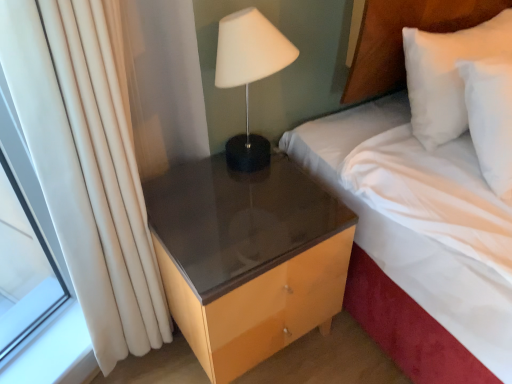
Locate an element on the screen. The image size is (512, 384). glossy wood nightstand at lower right is located at coordinates (247, 258).

What do you see at coordinates (247, 258) in the screenshot? I see `glossy wood nightstand at lower right` at bounding box center [247, 258].

Locate an element on the screen. The width and height of the screenshot is (512, 384). white soft pillow at upper right is located at coordinates (447, 74).

This screenshot has width=512, height=384. In order to click on white fabric bed at upper right in this screenshot , I will do (x=394, y=258).

Locate an element on the screen. The image size is (512, 384). white matte lamp at upper right is located at coordinates (249, 75).

Find the location of `glossy wood nightstand at lower right`. glossy wood nightstand at lower right is located at coordinates (247, 258).

Are white matte lamp at upper right and white fabric bed at upper right making contact?

No, white matte lamp at upper right is not in contact with white fabric bed at upper right.

From a real-world perspective, is white matte lamp at upper right above or below white fabric bed at upper right?

Clearly, from a real-world perspective, white matte lamp at upper right is above white fabric bed at upper right.

Considering the relative sizes of white matte lamp at upper right and white fabric bed at upper right in the image provided, is white matte lamp at upper right smaller than white fabric bed at upper right?

Yes.

Is white soft pillow at upper right not inside glossy wood nightstand at lower right?

Yes, white soft pillow at upper right is located beyond the bounds of glossy wood nightstand at lower right.

You are a GUI agent. You are given a task and a screenshot of the screen. Output one action in this format:
    pyautogui.click(x=<x>, y=<y>)
    Task: Click on the pillow on the right of glossy wood nightstand at lower right
    The height and width of the screenshot is (384, 512).
    Given the screenshot: What is the action you would take?
    pyautogui.click(x=447, y=74)

Relative to glossy wood nightstand at lower right, is white soft pillow at upper right in front or behind?

Visually, white soft pillow at upper right is located behind glossy wood nightstand at lower right.

Based on the photo, can you confirm if white soft pillow at upper right is bigger than white fabric bed at upper right?

Actually, white soft pillow at upper right might be smaller than white fabric bed at upper right.

Between white soft pillow at upper right and white fabric bed at upper right, which one appears on the left side from the viewer's perspective?

Positioned to the left is white soft pillow at upper right.

You are a GUI agent. You are given a task and a screenshot of the screen. Output one action in this format:
    pyautogui.click(x=<x>, y=<y>)
    Task: Click on the pillow behind the white fabric bed at upper right
    
    Given the screenshot: What is the action you would take?
    pyautogui.click(x=447, y=74)

How many degrees apart are the facing directions of white soft pillow at upper right and white fabric bed at upper right?

The facing directions of white soft pillow at upper right and white fabric bed at upper right are 1.35 degrees apart.

Which object is closer to the camera, white soft pillow at upper right or white matte lamp at upper right?

white matte lamp at upper right is more forward.

Is white matte lamp at upper right inside white soft pillow at upper right?

Actually, white matte lamp at upper right is outside white soft pillow at upper right.

From the image's perspective, is white soft pillow at upper right above white matte lamp at upper right?

Yes, from the image's perspective, white soft pillow at upper right is above white matte lamp at upper right.

Is white soft pillow at upper right at the left side of white matte lamp at upper right?

No.

From a real-world perspective, between white matte lamp at upper right and white soft pillow at upper right, who is vertically lower?

white soft pillow at upper right, from a real-world perspective.

Consider the image. Between white matte lamp at upper right and white soft pillow at upper right, which one has more height?

Standing taller between the two is white soft pillow at upper right.

Which of these two, white matte lamp at upper right or white soft pillow at upper right, is wider?

With larger width is white soft pillow at upper right.

Is white matte lamp at upper right outside of white soft pillow at upper right?

Answer: white matte lamp at upper right lies outside white soft pillow at upper right's area.

Does point (231, 292) lie behind point (278, 38)?

That is False.

In the scene shown: Considering the positions of objects glossy wood nightstand at lower right and white matte lamp at upper right in the image provided, who is more to the right, glossy wood nightstand at lower right or white matte lamp at upper right?

white matte lamp at upper right.

This screenshot has height=384, width=512. In order to click on nightstand that appears below the white matte lamp at upper right (from the image's perspective) in this screenshot , I will do `click(247, 258)`.

Is the depth of white matte lamp at upper right greater than that of glossy wood nightstand at lower right?

No, the depth of white matte lamp at upper right is less than that of glossy wood nightstand at lower right.

From the image's perspective, is white matte lamp at upper right located above or below glossy wood nightstand at lower right?

white matte lamp at upper right is situated higher than glossy wood nightstand at lower right in the image.

Is white matte lamp at upper right at the right side of glossy wood nightstand at lower right?

Yes.

Is there a large distance between white matte lamp at upper right and glossy wood nightstand at lower right?

They are positioned close to each other.

Where is `bedside lamp above the white fabric bed at upper right (from a real-world perspective)`? This screenshot has width=512, height=384. bedside lamp above the white fabric bed at upper right (from a real-world perspective) is located at coordinates (249, 75).

Find the location of `nightstand in front of the white soft pillow at upper right`. nightstand in front of the white soft pillow at upper right is located at coordinates (247, 258).

Estimate the real-world distances between objects in this image. Which object is closer to white fabric bed at upper right, white soft pillow at upper right or white matte lamp at upper right?

white soft pillow at upper right lies closer to white fabric bed at upper right than the other object.

Based on their spatial positions, is glossy wood nightstand at lower right or white fabric bed at upper right further from white matte lamp at upper right?

white fabric bed at upper right is positioned further to the anchor white matte lamp at upper right.

Considering their positions, is white fabric bed at upper right positioned further to white matte lamp at upper right than white soft pillow at upper right?

white fabric bed at upper right is further to white matte lamp at upper right.

From the picture: Considering their positions, is white fabric bed at upper right positioned further to white soft pillow at upper right than glossy wood nightstand at lower right?

glossy wood nightstand at lower right is further to white soft pillow at upper right.

Which object lies nearer to the anchor point glossy wood nightstand at lower right, white matte lamp at upper right or white soft pillow at upper right?

white matte lamp at upper right is closer to glossy wood nightstand at lower right.

Which object lies nearer to the anchor point glossy wood nightstand at lower right, white soft pillow at upper right or white fabric bed at upper right?

white fabric bed at upper right.

When comparing their distances from white matte lamp at upper right, does white soft pillow at upper right or white fabric bed at upper right seem further?

Based on the image, white fabric bed at upper right appears to be further to white matte lamp at upper right.

Looking at the image, which one is located closer to white matte lamp at upper right, glossy wood nightstand at lower right or white soft pillow at upper right?

Among the two, glossy wood nightstand at lower right is located nearer to white matte lamp at upper right.

This screenshot has height=384, width=512. What are the coordinates of `bedside lamp between glossy wood nightstand at lower right and white soft pillow at upper right from left to right` in the screenshot? It's located at (249, 75).

At what (x,y) coordinates should I click in order to perform the action: click on pillow between white matte lamp at upper right and white fabric bed at upper right in the horizontal direction. Please return your answer as a coordinate pair (x, y). This screenshot has width=512, height=384. Looking at the image, I should click on (447, 74).

I want to click on pillow between glossy wood nightstand at lower right and white fabric bed at upper right in the horizontal direction, so click(447, 74).

At what (x,y) coordinates should I click in order to perform the action: click on bedside lamp located between glossy wood nightstand at lower right and white fabric bed at upper right in the left-right direction. Please return your answer as a coordinate pair (x, y). This screenshot has width=512, height=384. Looking at the image, I should click on (249, 75).